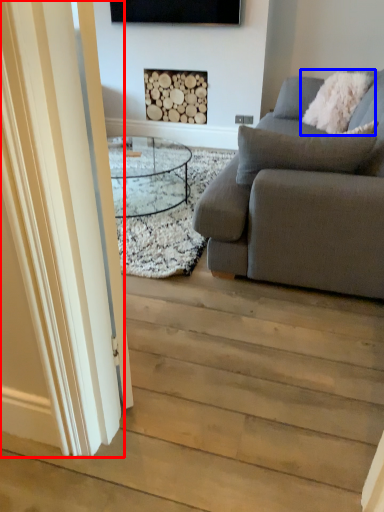
Question: Which object is closer to the camera taking this photo, glass door (highlighted by a red box) or pillow (highlighted by a blue box)?

Choices:
 (A) glass door
 (B) pillow

Answer: (A)